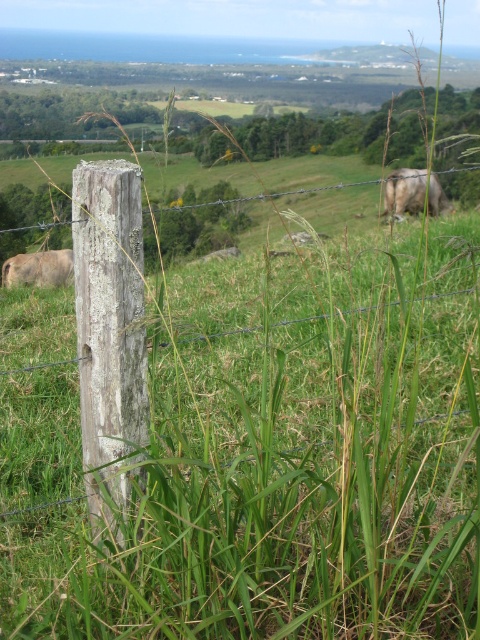
In the scene shown: You are a farmer who needs to separate the two cows using a temporary electric fence. The electric fence can only be placed between the two cows. Given the distance between the white woolly cow at upper right and the brown matte cow at left, what is the minimum length of the electric fence needed to ensure both cows are safely separated?

The minimum length of the electric fence needed is 12.06 feet to ensure both the white woolly cow at upper right and the brown matte cow at left are safely separated.

You are a farmer checking on your cows. You see the white woolly cow at upper right and the brown matte cow at left. Which cow is closer to the fence post in the foreground?

The white woolly cow at upper right is closer to the fence post in the foreground because the brown matte cow at left is behind it.

You are a farmer checking the pasture. You notice the white woolly cow at upper right and the brown matte cow at left. Which cow would cast a bigger shadow if the sun is directly overhead?

The white woolly cow at upper right is larger in size than the brown matte cow at left, so it would cast a bigger shadow.